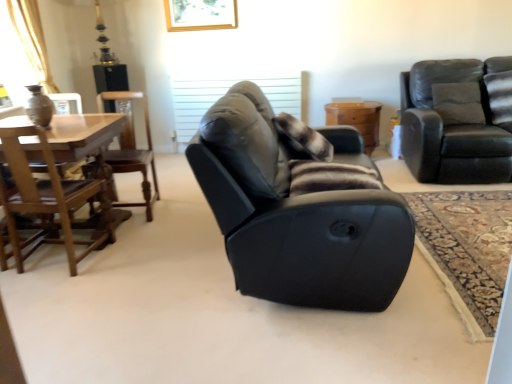
Image resolution: width=512 pixels, height=384 pixels. I want to click on free space in front of wooden chair at left, marked as the 3th chair in a right-to-left arrangement, so click(x=144, y=229).